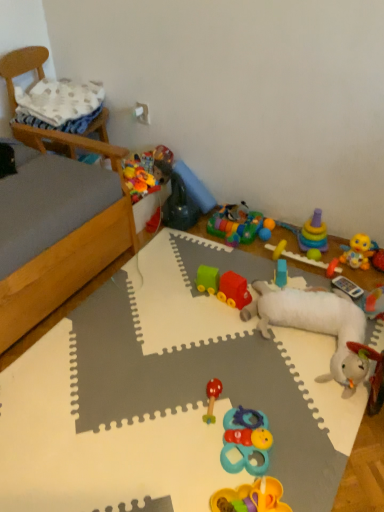
Find the location of `vacant area located to the right-hand side of green rubber ball at upper right, arranged as the 7th toy when ordered from the bottom`. vacant area located to the right-hand side of green rubber ball at upper right, arranged as the 7th toy when ordered from the bottom is located at coordinates (334, 256).